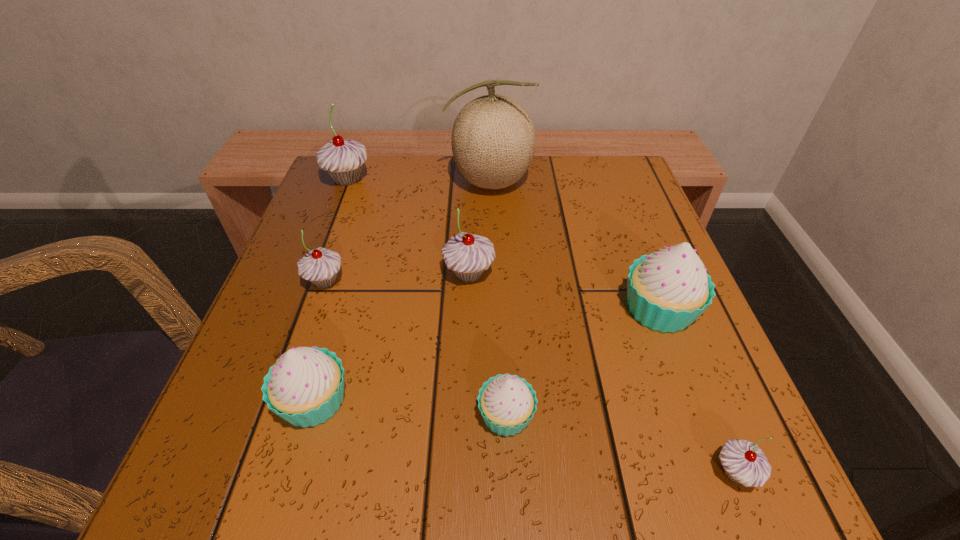
In order to click on object that is the second closest to the biggest gray cupcake in this screenshot , I will do `click(320, 266)`.

This screenshot has width=960, height=540. What are the coordinates of `the seventh closest object relative to the cantaloup` in the screenshot? It's located at (743, 462).

I want to click on cupcake that can be found as the fourth closest to the smallest gray cupcake, so click(305, 387).

Identify which cupcake is located as the fourth nearest to the third smallest gray cupcake. Please provide its 2D coordinates. Your answer should be formatted as a tuple, i.e. [(x, y)], where the tuple contains the x and y coordinates of a point satisfying the conditions above.

[(668, 290)]

This screenshot has height=540, width=960. Identify the location of gray cupcake that is the fourth closest to the tallest object. (743, 462).

In order to click on the closest gray cupcake to the rightmost gray cupcake in this screenshot , I will do `click(467, 255)`.

Where is `white cupcake object that ranks as the second closest to the farthest white cupcake`? The width and height of the screenshot is (960, 540). white cupcake object that ranks as the second closest to the farthest white cupcake is located at coordinates pos(305,387).

Where is `white cupcake that can be found as the third closest to the biggest gray cupcake`? white cupcake that can be found as the third closest to the biggest gray cupcake is located at coordinates (668, 290).

The image size is (960, 540). Find the location of `vacant space that satisfies the following two spatial constraints: 1. on the front side of the second white cupcake from right to left; 2. on the left side of the nearest object`. vacant space that satisfies the following two spatial constraints: 1. on the front side of the second white cupcake from right to left; 2. on the left side of the nearest object is located at coordinates (509, 472).

Locate an element on the screen. This screenshot has width=960, height=540. vacant space that satisfies the following two spatial constraints: 1. on the front side of the second smallest gray cupcake; 2. on the left side of the nearest cupcake is located at coordinates (259, 472).